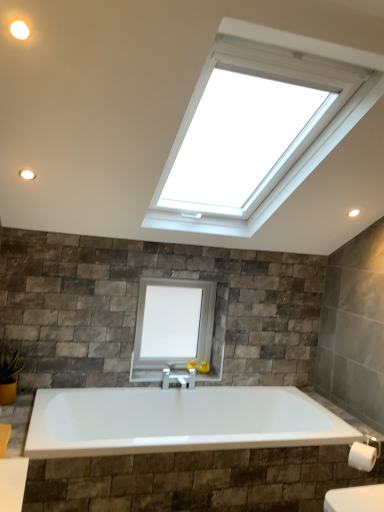
Question: Could green glossy plant at lower left be considered to be inside white matte window at center?

Choices:
 (A) yes
 (B) no

Answer: (B)

Question: Considering the relative sizes of white matte window at center and green glossy plant at lower left in the image provided, is white matte window at center wider than green glossy plant at lower left?

Choices:
 (A) no
 (B) yes

Answer: (A)

Question: Could you tell me if white matte window at center is turned towards green glossy plant at lower left?

Choices:
 (A) yes
 (B) no

Answer: (B)

Question: Is white matte window at center further to the viewer compared to green glossy plant at lower left?

Choices:
 (A) yes
 (B) no

Answer: (A)

Question: From the image's perspective, is white matte window at center above green glossy plant at lower left?

Choices:
 (A) yes
 (B) no

Answer: (A)

Question: From a real-world perspective, is white matte window at center on green glossy plant at lower left?

Choices:
 (A) no
 (B) yes

Answer: (B)

Question: Is white matte toilet paper at lower right far from green glossy plant at lower left?

Choices:
 (A) no
 (B) yes

Answer: (B)

Question: Considering the relative positions of white matte toilet paper at lower right and green glossy plant at lower left in the image provided, is white matte toilet paper at lower right to the right of green glossy plant at lower left from the viewer's perspective?

Choices:
 (A) no
 (B) yes

Answer: (B)

Question: From the image's perspective, is white matte toilet paper at lower right beneath green glossy plant at lower left?

Choices:
 (A) no
 (B) yes

Answer: (B)

Question: Can you confirm if white matte toilet paper at lower right is positioned to the left of green glossy plant at lower left?

Choices:
 (A) no
 (B) yes

Answer: (A)

Question: Is white matte toilet paper at lower right not within green glossy plant at lower left?

Choices:
 (A) yes
 (B) no

Answer: (A)

Question: Does white matte toilet paper at lower right have a lesser width compared to green glossy plant at lower left?

Choices:
 (A) yes
 (B) no

Answer: (A)

Question: Is white matte light fixture at upper left positioned behind white matte window at center?

Choices:
 (A) yes
 (B) no

Answer: (B)